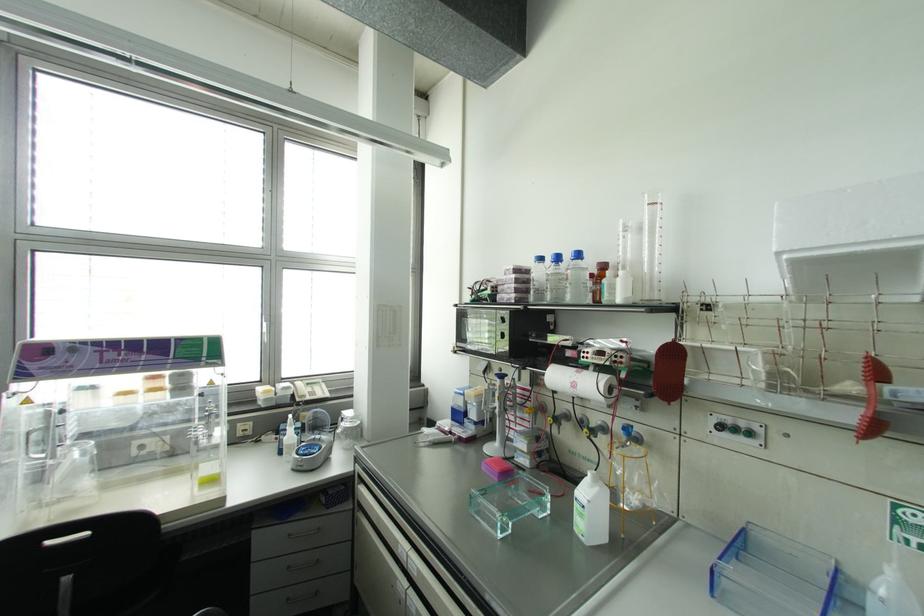
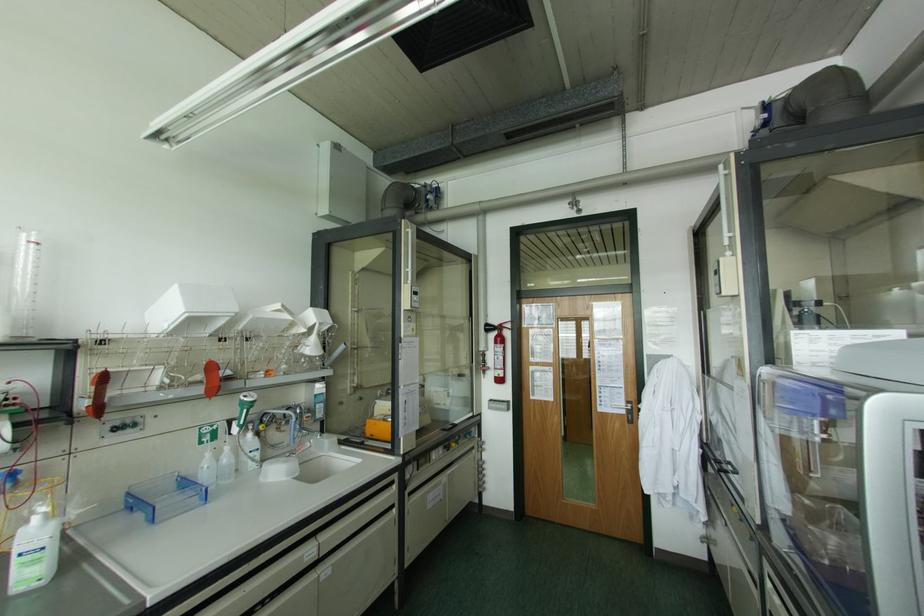
In the second image, find the point that corresponds to point 596,488 in the first image.

(53, 523)